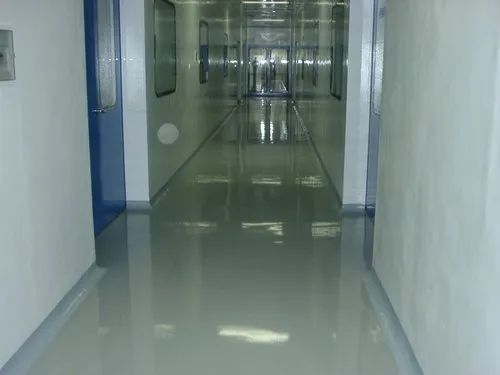
Find the location of a particular element. The height and width of the screenshot is (375, 500). door window is located at coordinates (106, 78).